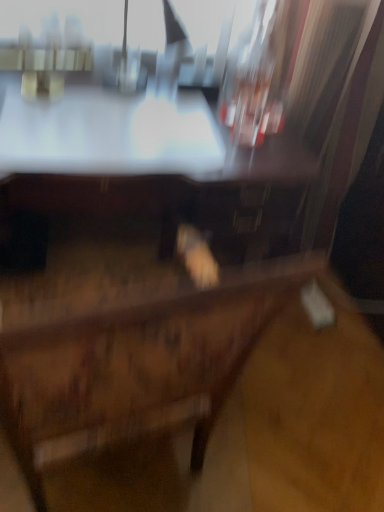
What do you see at coordinates (147, 161) in the screenshot? The width and height of the screenshot is (384, 512). I see `wooden table at center` at bounding box center [147, 161].

Locate an element on the screen. This screenshot has width=384, height=512. wooden table at center is located at coordinates (147, 161).

In order to click on wooden table at center in this screenshot , I will do `click(147, 161)`.